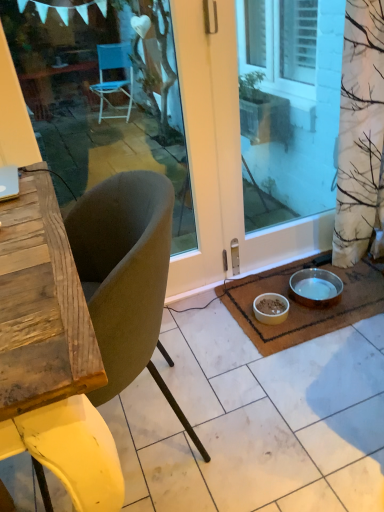
Question: Can you see brown woven mat at lower right touching white matte bowl at lower center, positioned as the second bowl in right-to-left order?

Choices:
 (A) no
 (B) yes

Answer: (A)

Question: Is brown woven mat at lower right outside white matte bowl at lower center, the first bowl viewed from the left?

Choices:
 (A) no
 (B) yes

Answer: (B)

Question: Does brown woven mat at lower right have a lesser height compared to white matte bowl at lower center, the first bowl viewed from the left?

Choices:
 (A) yes
 (B) no

Answer: (A)

Question: Is the depth of brown woven mat at lower right greater than that of white matte bowl at lower center, positioned as the second bowl in right-to-left order?

Choices:
 (A) no
 (B) yes

Answer: (A)

Question: Is brown woven mat at lower right wider than white matte bowl at lower center, positioned as the second bowl in right-to-left order?

Choices:
 (A) yes
 (B) no

Answer: (A)

Question: From a real-world perspective, is brown woven mat at lower right over white matte bowl at lower center, positioned as the second bowl in right-to-left order?

Choices:
 (A) yes
 (B) no

Answer: (B)

Question: Is metallic silver bowl at lower right, marked as the second bowl in a left-to-right arrangement, beside brown woven mat at lower right?

Choices:
 (A) yes
 (B) no

Answer: (B)

Question: From a real-world perspective, is metallic silver bowl at lower right, marked as the second bowl in a left-to-right arrangement, under brown woven mat at lower right?

Choices:
 (A) no
 (B) yes

Answer: (A)

Question: From a real-world perspective, is metallic silver bowl at lower right, the first bowl viewed from the right, on brown woven mat at lower right?

Choices:
 (A) yes
 (B) no

Answer: (A)

Question: Is metallic silver bowl at lower right, the first bowl viewed from the right, turned away from brown woven mat at lower right?

Choices:
 (A) yes
 (B) no

Answer: (B)

Question: Are metallic silver bowl at lower right, marked as the second bowl in a left-to-right arrangement, and brown woven mat at lower right located far from each other?

Choices:
 (A) yes
 (B) no

Answer: (B)

Question: Does metallic silver bowl at lower right, marked as the second bowl in a left-to-right arrangement, have a greater width compared to brown woven mat at lower right?

Choices:
 (A) yes
 (B) no

Answer: (B)

Question: Does transparent glass door at center, the second window screen in the left-to-right sequence, lie behind white matte bowl at lower center, the first bowl viewed from the left?

Choices:
 (A) yes
 (B) no

Answer: (B)